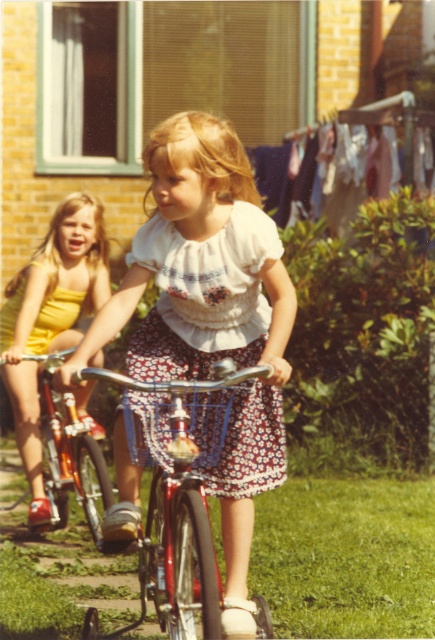
You are a delivery person who needs to carry a package that is 2 meters long. You see the shiny metallic bicycle at center and the shiny orange bicycle at left. Which bicycle has a wider frame to accommodate the package?

The shiny metallic bicycle at center might be wider than shiny orange bicycle at left, so it could potentially accommodate the wider package.

You are a photographer trying to capture both the matte white blouse at center and the shiny metallic bicycle at center in a single frame. Given that the camera can only focus on objects within a 1.5 meter width, can both objects fit in the frame?

The matte white blouse at center is wider than the shiny metallic bicycle at center. Since the camera can only focus on objects within a 1.5 meter width, the total width of both objects combined may exceed the frame limit. Therefore, it might not be possible to fit both in the frame without adjusting the camera angle or zoom.

Looking at this image, you are a photographer standing at the starting point of the bicycle path. You want to take a photo of the matte white blouse at center and the cloth fabric clothesline at upper center. However, you need to ensure that both subjects are in focus. Given that your camera can only focus on objects within a 5 meter range, will you be able to capture both subjects clearly?

The matte white blouse at center is 5.62 meters away from the cloth fabric clothesline at upper center. Since the distance between them exceeds the camera focus range of 5 meters, you cannot capture both subjects clearly in focus at the same time.